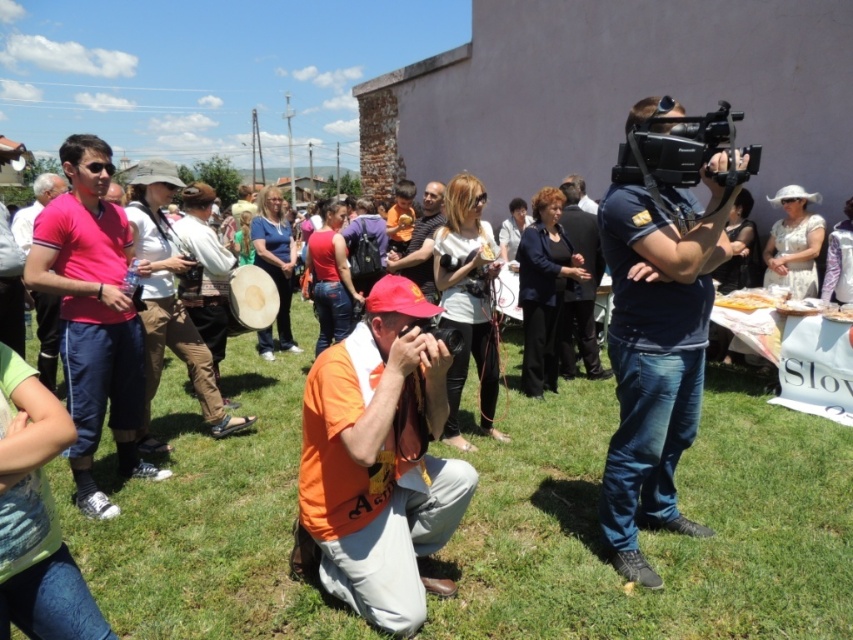
Question: Observing the image, what is the correct spatial positioning of orange fabric shirt at center in reference to dark blue denim jeans at center?

Choices:
 (A) above
 (B) below

Answer: (B)

Question: Which point appears farthest from the camera in this image?

Choices:
 (A) (465, 504)
 (B) (90, 268)

Answer: (B)

Question: Does orange fabric shirt at center have a lesser width compared to black plastic video camera at upper right?

Choices:
 (A) no
 (B) yes

Answer: (A)

Question: Which point is closer to the camera taking this photo?

Choices:
 (A) (80, 355)
 (B) (695, 180)
 (C) (569, 364)

Answer: (B)

Question: Considering the relative positions of dark blue denim jeans at center and pink fabric shirt at left in the image provided, where is dark blue denim jeans at center located with respect to pink fabric shirt at left?

Choices:
 (A) below
 (B) above

Answer: (A)

Question: Which point is farther to the camera?

Choices:
 (A) (329, 394)
 (B) (434, 195)
 (C) (177, 445)

Answer: (B)